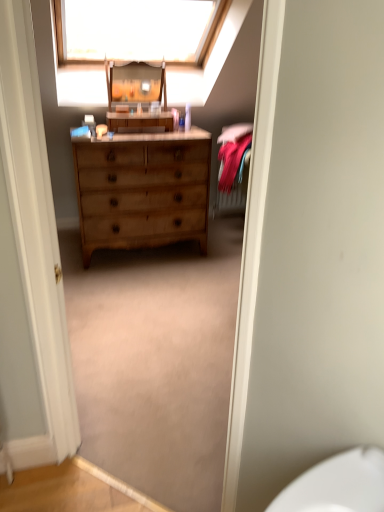
Question: In terms of width, does white fabric at upper center look wider or thinner when compared to velvet pink bed at right?

Choices:
 (A) thin
 (B) wide

Answer: (B)

Question: In terms of height, does white fabric at upper center look taller or shorter compared to velvet pink bed at right?

Choices:
 (A) short
 (B) tall

Answer: (A)

Question: Considering the real-world distances, which object is farthest from the velvet pink bed at right?

Choices:
 (A) wooden dresser at center
 (B) wooden changing table at center
 (C) white fabric at upper center
 (D) light brown wood dresser at center

Answer: (C)

Question: Based on their relative distances, which object is nearer to the wooden dresser at center?

Choices:
 (A) velvet pink bed at right
 (B) wooden changing table at center
 (C) light brown wood dresser at center
 (D) white fabric at upper center

Answer: (B)